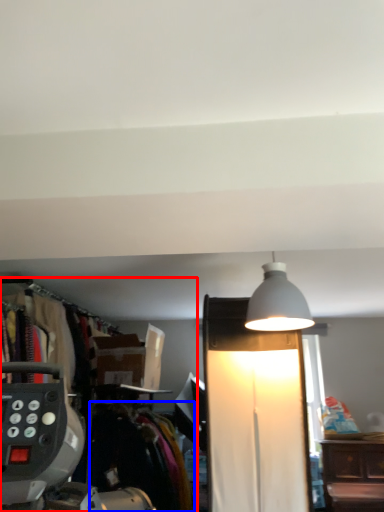
Question: Which object is further to the camera taking this photo, closet (highlighted by a red box) or clothing (highlighted by a blue box)?

Choices:
 (A) closet
 (B) clothing

Answer: (A)